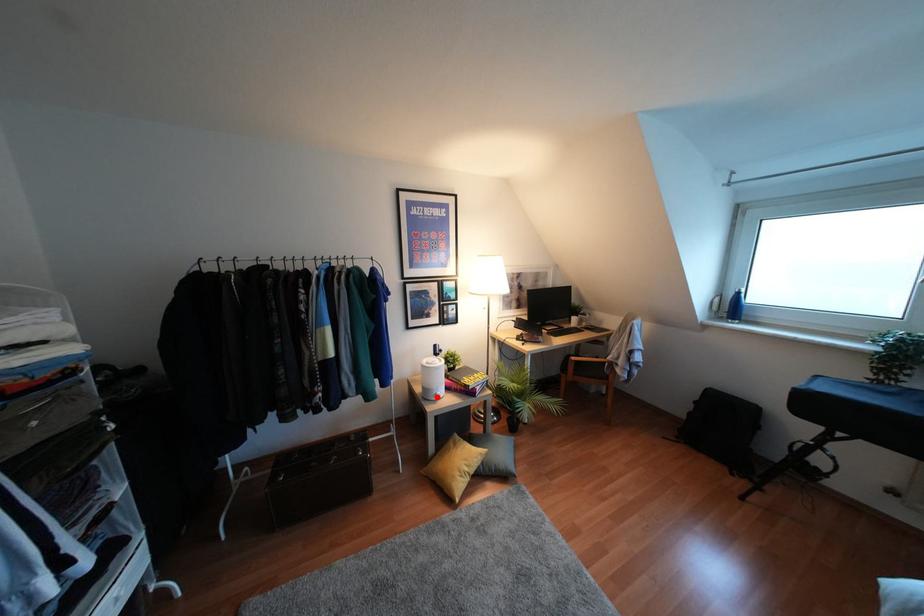
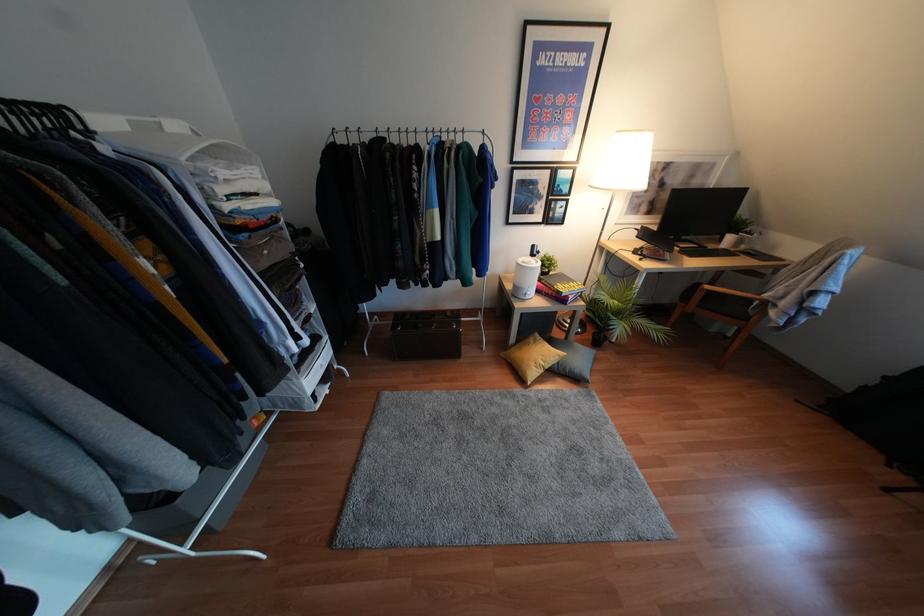
The point at the highlighted location is marked in the first image. Where is the corresponding point in the second image?

(526, 297)